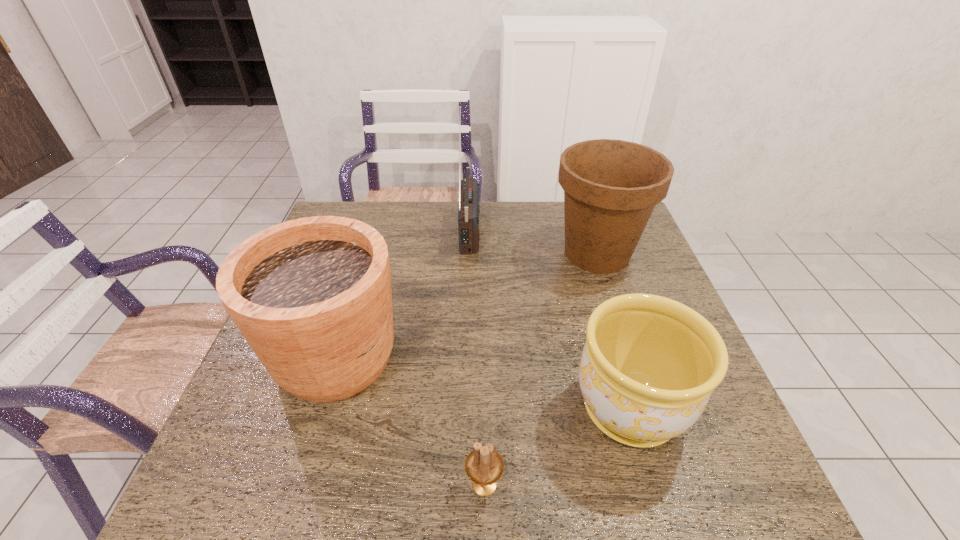
Find the location of `free space at the left edge of the desktop`. free space at the left edge of the desktop is located at coordinates (258, 455).

What are the coordinates of `blank area at the right edge` in the screenshot? It's located at (632, 269).

Image resolution: width=960 pixels, height=540 pixels. Find the location of `vacant position at the near left corner of the desktop`. vacant position at the near left corner of the desktop is located at coordinates (261, 475).

You are a GUI agent. You are given a task and a screenshot of the screen. Output one action in this format:
    pyautogui.click(x=<x>, y=<y>)
    Task: Click on the free space between the radio receiver and the candle holder
    This screenshot has width=960, height=540.
    Given the screenshot: What is the action you would take?
    pyautogui.click(x=477, y=357)

At what (x,y) coordinates should I click in order to perform the action: click on free spot between the farthest flowerpot and the candle holder. Please return your answer as a coordinate pair (x, y). Image resolution: width=960 pixels, height=540 pixels. Looking at the image, I should click on (540, 369).

This screenshot has width=960, height=540. What are the coordinates of `free spot between the radio receiver and the farthest flowerpot` in the screenshot? It's located at (534, 241).

This screenshot has width=960, height=540. Identify the location of vacant space that is in between the shortest flowerpot and the radio receiver. (550, 319).

Find the location of a particular element. The image size is (960, 540). unoccupied area between the leftmost object and the farthest flowerpot is located at coordinates (467, 305).

Identify the location of free area in between the candle holder and the farthest flowerpot. Image resolution: width=960 pixels, height=540 pixels. (540, 369).

I want to click on unoccupied position between the candle holder and the farthest flowerpot, so click(x=540, y=369).